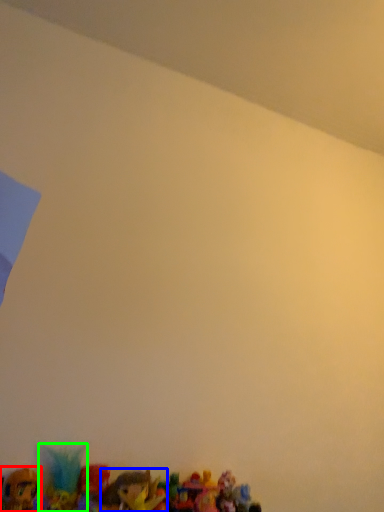
Question: Based on their relative distances, which object is nearer to toy (highlighted by a red box)? Choose from toy (highlighted by a blue box) and toy (highlighted by a green box).

Choices:
 (A) toy
 (B) toy

Answer: (B)